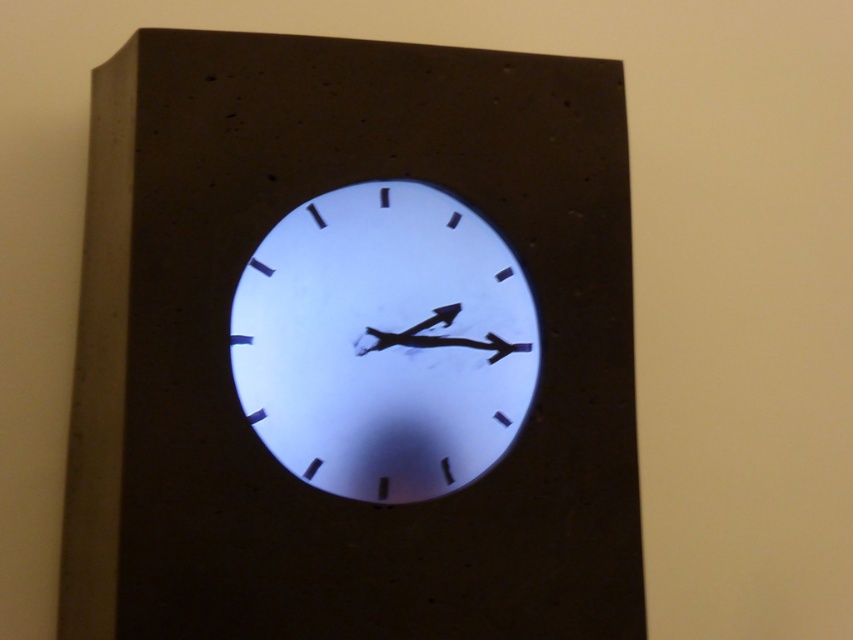
Find the location of a particular element. white matte clock at center is located at coordinates (352, 346).

Does white matte clock at center have a lesser width compared to white glossy clock at center?

Incorrect, white matte clock at center's width is not less than white glossy clock at center's.

Locate an element on the screen. white matte clock at center is located at coordinates (352, 346).